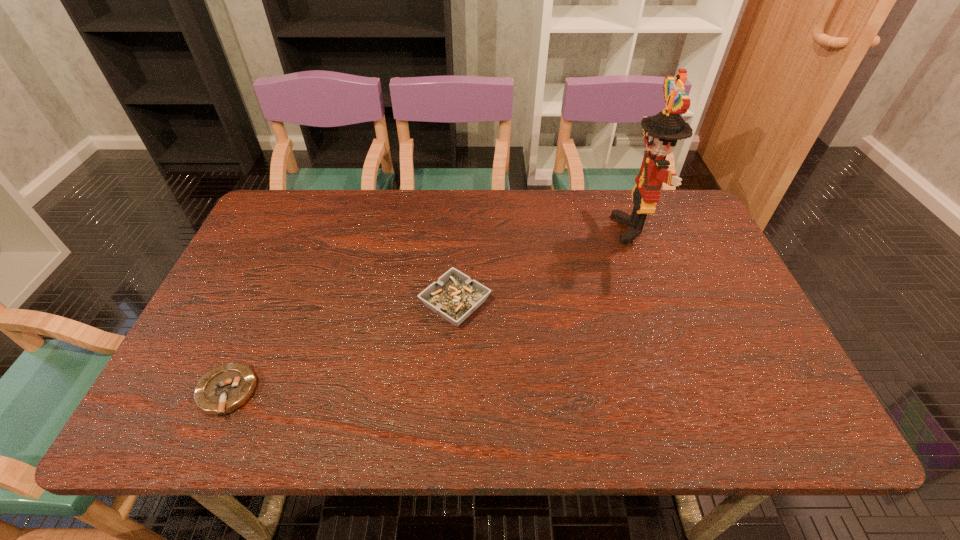
Where is `free space at the right edge of the desktop`? This screenshot has height=540, width=960. free space at the right edge of the desktop is located at coordinates (683, 271).

In the image, there is a desktop. Where is `vacant space at the near left corner`? The width and height of the screenshot is (960, 540). vacant space at the near left corner is located at coordinates (198, 426).

In the image, there is a desktop. At what (x,y) coordinates should I click in order to perform the action: click on vacant space at the far right corner. Please return your answer as a coordinate pair (x, y). This screenshot has width=960, height=540. Looking at the image, I should click on (684, 211).

The height and width of the screenshot is (540, 960). What are the coordinates of `vacant space at the near right corner of the desktop` in the screenshot? It's located at (787, 413).

Locate an element on the screen. Image resolution: width=960 pixels, height=540 pixels. free space between the rightmost object and the taller ashtray is located at coordinates (545, 266).

Where is `free space between the nearer ashtray and the rightmost object`? This screenshot has width=960, height=540. free space between the nearer ashtray and the rightmost object is located at coordinates (431, 310).

Locate an element on the screen. Image resolution: width=960 pixels, height=540 pixels. vacant area that lies between the shortest object and the taller ashtray is located at coordinates (341, 348).

Identify the location of vacant space that is in between the farthest object and the second object from left to right. This screenshot has width=960, height=540. (545, 266).

The image size is (960, 540). Find the location of `free space between the nutcracker and the nearest object`. free space between the nutcracker and the nearest object is located at coordinates (x=431, y=310).

Image resolution: width=960 pixels, height=540 pixels. What are the coordinates of `vacant area that lies between the second nearest object and the rightmost object` in the screenshot? It's located at (545, 266).